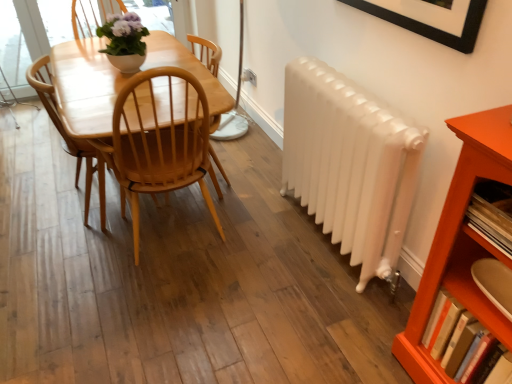
Question: Is matte white pot at upper center situated inside light brown wood chair at center or outside?

Choices:
 (A) outside
 (B) inside

Answer: (A)

Question: From a real-world perspective, is matte white pot at upper center physically located above or below light brown wood chair at center?

Choices:
 (A) above
 (B) below

Answer: (A)

Question: Which object is positioned closest to the white glossy radiator at right?

Choices:
 (A) matte white pot at upper center
 (B) orange wood shelf at lower right
 (C) light brown wood chair at center
 (D) hardcover book at lower right, the second book when ordered from top to bottom
 (E) wooden bookshelf at right, placed as the second book when sorted from bottom to top

Answer: (B)

Question: Considering the real-world distances, which object is farthest from the light brown wood chair at center?

Choices:
 (A) hardcover book at lower right, the second book when ordered from top to bottom
 (B) white glossy radiator at right
 (C) wooden bookshelf at right, placed as the second book when sorted from bottom to top
 (D) matte white pot at upper center
 (E) orange wood shelf at lower right

Answer: (C)